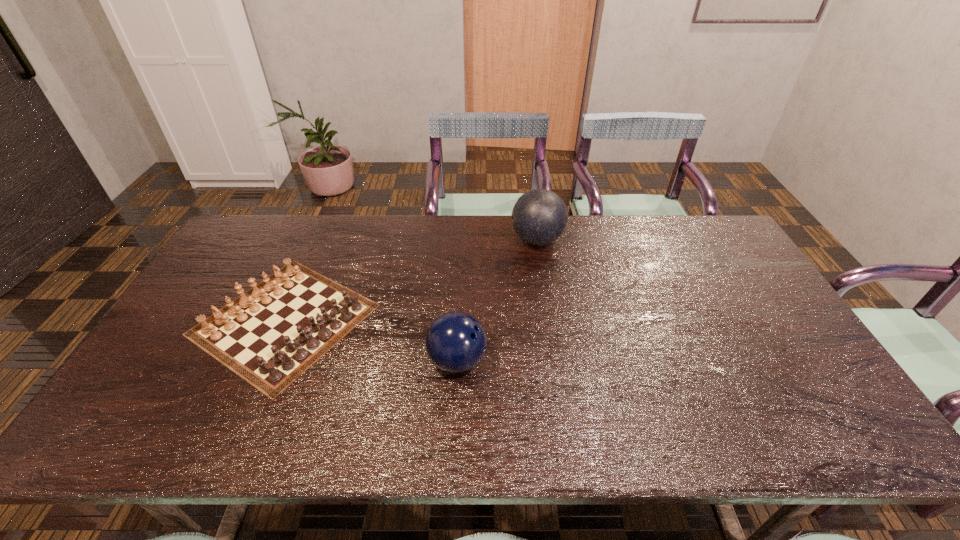
Where is `free spot that satisfies the following two spatial constraints: 1. on the grip area of the farthest object; 2. on the front side of the chessboard`? The image size is (960, 540). free spot that satisfies the following two spatial constraints: 1. on the grip area of the farthest object; 2. on the front side of the chessboard is located at coordinates (550, 319).